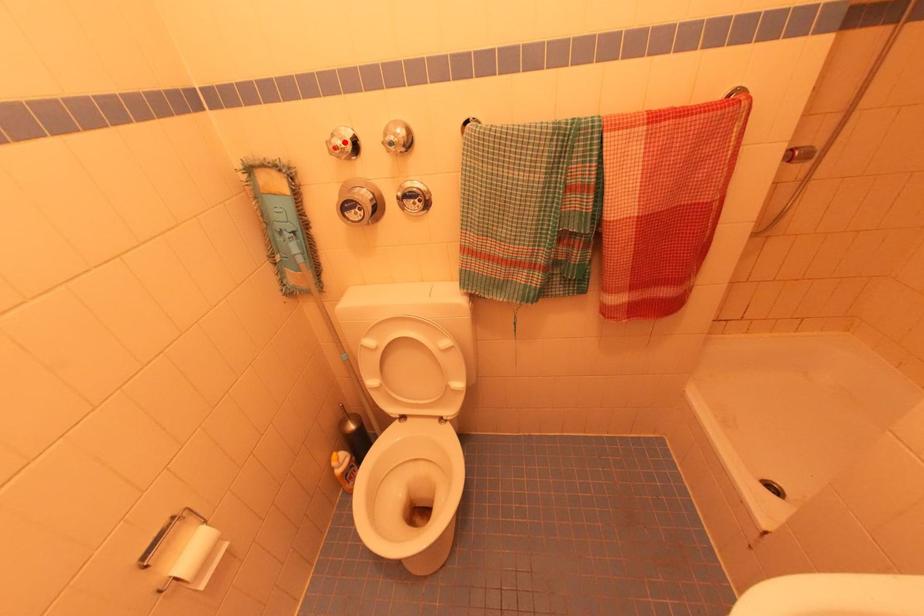
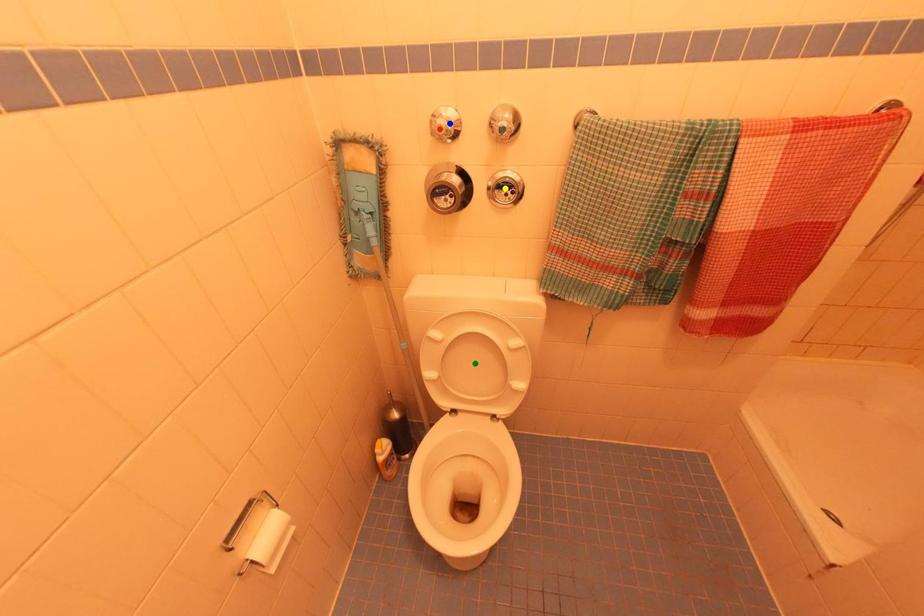
Question: I am providing you with two images of the same scene from different viewpoints. A red point is marked on the first image. You are given multiple points on the second image. Can you choose the point in image 2 that corresponds to the point in image 1?

Choices:
 (A) green point
 (B) blue point
 (C) yellow point

Answer: (B)